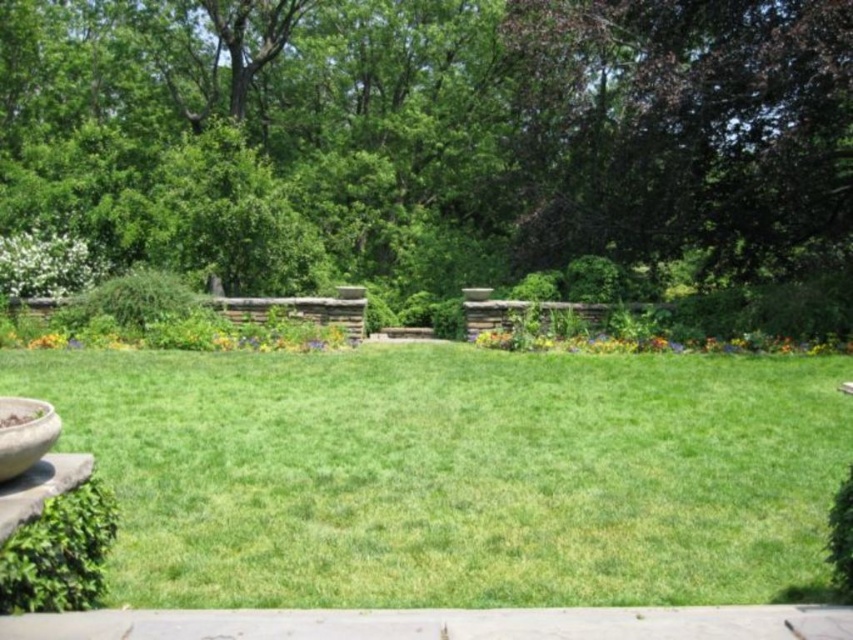
You are a gardener who wants to water the green grass at center. You have a watering can in your hand. To reach the grass, do you need to move the matte concrete bowl at lower left out of the way?

The green grass at center is positioned under the matte concrete bowl at lower left, so yes, you need to move the matte concrete bowl at lower left to access the green grass at center.

Consider the image. You are a gardener who wants to place a new decorative item on the lawn. You have a small statue that is 10 cm tall. Considering the green grass at center and the matte concrete bowl at lower left, which location would allow the statue to be more visible?

The statue would be more visible if placed on the matte concrete bowl at lower left because the green grass at center is taller than the matte concrete bowl at lower left, so placing it on the bowl would keep it above the grass height.

Based on the photo, you are planning to place a small garden statue that is 2 feet tall. You see the green leafy tree at center and the matte concrete bowl at lower left. Which object can the statue be placed next to without being completely hidden from view?

The statue can be placed next to the matte concrete bowl at lower left because the green leafy tree at center is larger and would likely obscure the statue if placed nearby.